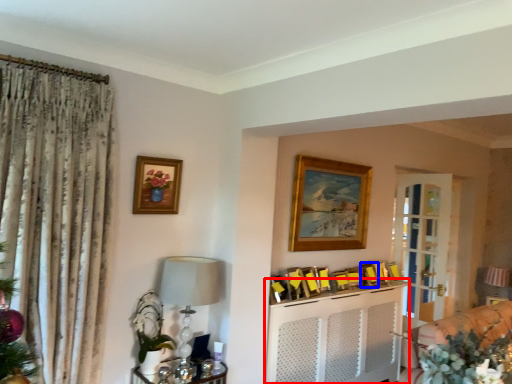
Question: Which of the following is the farthest to the observer, entertainment center (highlighted by a red box) or picture frame (highlighted by a blue box)?

Choices:
 (A) entertainment center
 (B) picture frame

Answer: (B)